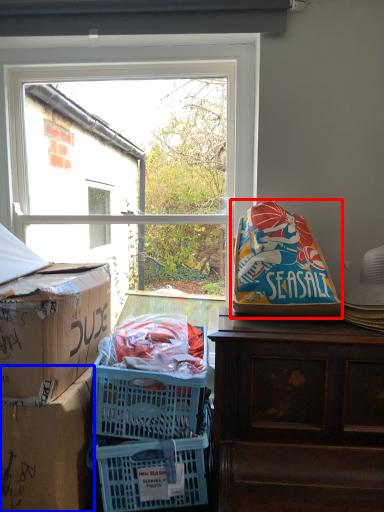
Question: Which object is closer to the camera taking this photo, bean bag chair (highlighted by a red box) or box (highlighted by a blue box)?

Choices:
 (A) bean bag chair
 (B) box

Answer: (B)